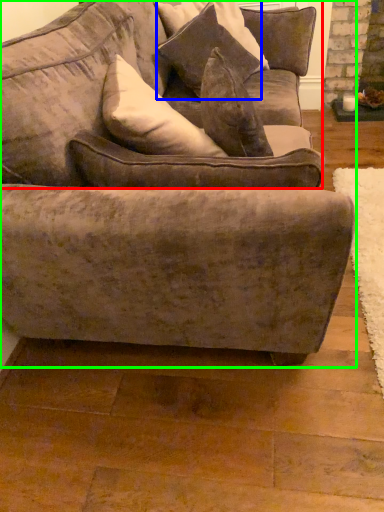
Question: Which object is the closest to the couch (highlighted by a red box)? Choose among these: pillow (highlighted by a blue box) or studio couch (highlighted by a green box).

Choices:
 (A) pillow
 (B) studio couch

Answer: (B)